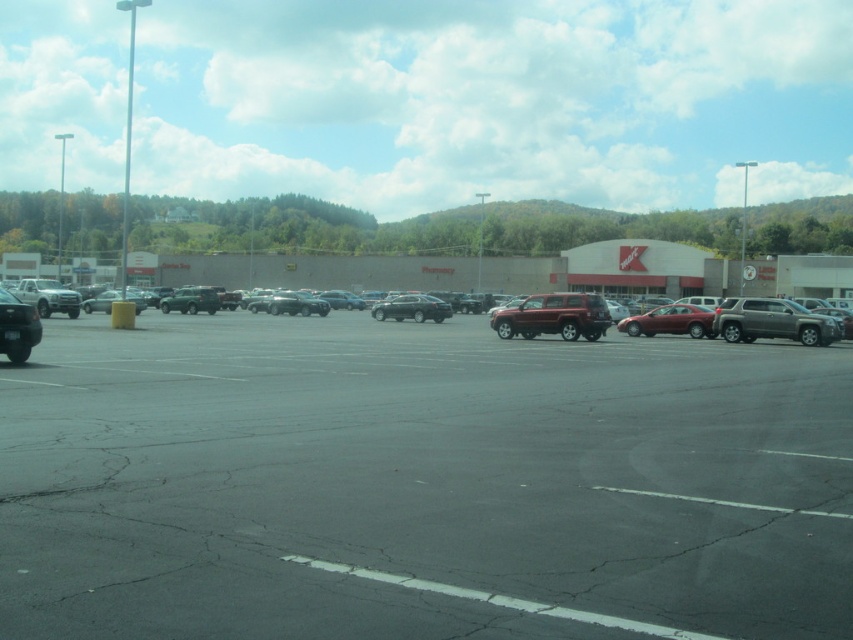
Question: Which point is closer to the camera taking this photo?

Choices:
 (A) (711, 328)
 (B) (801, 330)
 (C) (25, 352)

Answer: (C)

Question: Is satin silver suv at right further to camera compared to shiny black sedan at left?

Choices:
 (A) no
 (B) yes

Answer: (B)

Question: Which point is closer to the camera?

Choices:
 (A) (698, 314)
 (B) (0, 296)
 (C) (577, 298)

Answer: (B)

Question: Which object is the closest to the matte black suv at center?

Choices:
 (A) asphalt at center
 (B) satin silver suv at right

Answer: (B)

Question: Can you confirm if satin red suv at center is smaller than satin red sedan at center?

Choices:
 (A) yes
 (B) no

Answer: (A)

Question: Can you confirm if matte black suv at center is positioned above satin red suv at center?

Choices:
 (A) no
 (B) yes

Answer: (B)